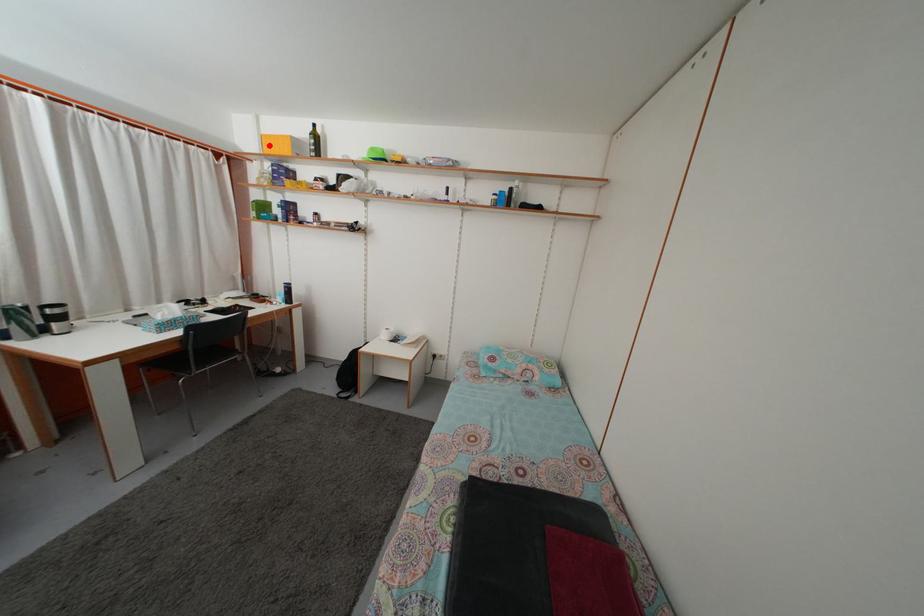
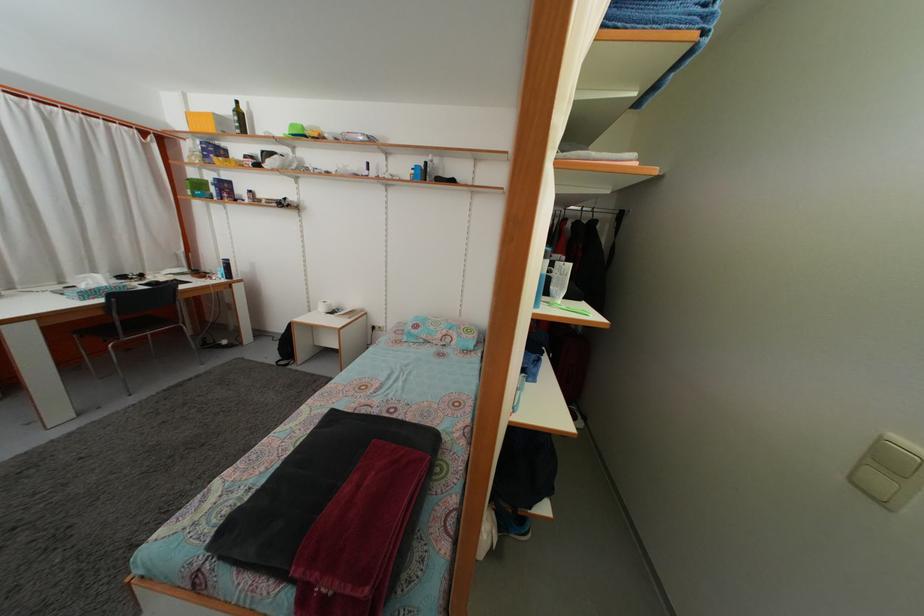
The point at the highlighted location is marked in the first image. Where is the corresponding point in the second image?

(196, 123)